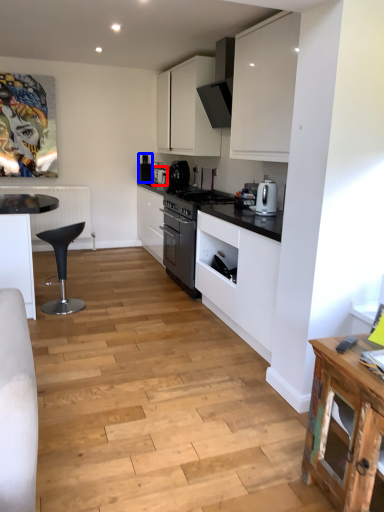
Question: Which object appears closest to the camera in this image, kitchen appliance (highlighted by a red box) or appliance (highlighted by a blue box)?

Choices:
 (A) kitchen appliance
 (B) appliance

Answer: (A)